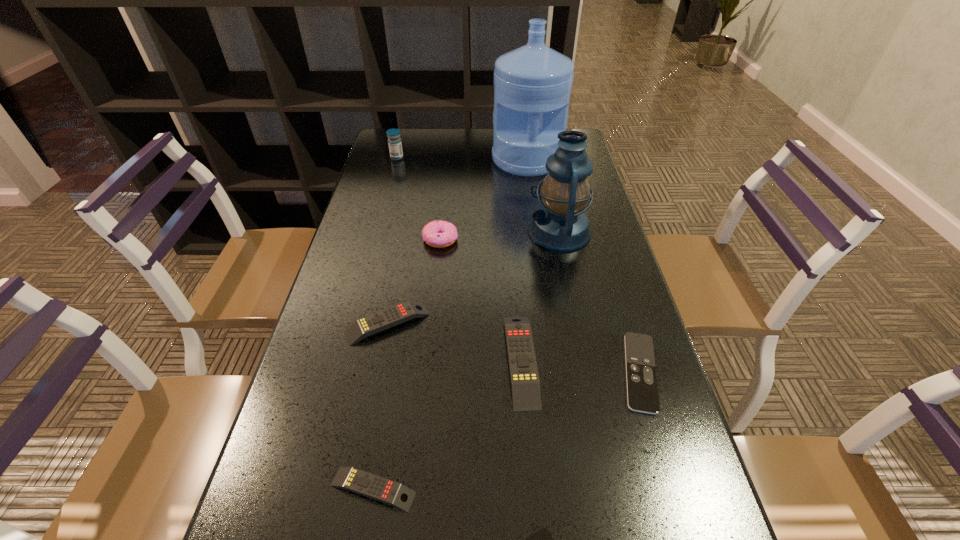
Locate an element on the screen. This screenshot has height=540, width=960. lantern present at the right edge is located at coordinates (560, 225).

Where is `remote control present at the right edge`? This screenshot has width=960, height=540. remote control present at the right edge is located at coordinates (642, 390).

This screenshot has height=540, width=960. Find the location of `object located at the far left corner`. object located at the far left corner is located at coordinates (394, 141).

Locate an element on the screen. object that is at the far right corner is located at coordinates (532, 84).

You are a GUI agent. You are given a task and a screenshot of the screen. Output one action in this format:
    pyautogui.click(x=<x>, y=<y>)
    Task: Click on the blank space at the far edge
    Image resolution: width=960 pixels, height=540 pixels.
    Given the screenshot: What is the action you would take?
    462,136

I want to click on free space at the left edge, so 382,188.

In the image, there is a desktop. Where is `free space at the right edge`? The width and height of the screenshot is (960, 540). free space at the right edge is located at coordinates (695, 530).

Find the location of a particular element. vacant space at the far left corner is located at coordinates (382, 155).

At what (x,y) coordinates should I click in order to perform the action: click on blank region between the tallest remote control and the sixth tallest object. Please return your answer as a coordinate pair (x, y). Image resolution: width=960 pixels, height=540 pixels. Looking at the image, I should click on (454, 341).

You are a GUI agent. You are given a task and a screenshot of the screen. Output one action in this format:
    pyautogui.click(x=<x>, y=<y>)
    Task: Click on the vacant space that is in between the fifth shortest object and the doughnut
    
    Given the screenshot: What is the action you would take?
    pyautogui.click(x=481, y=300)